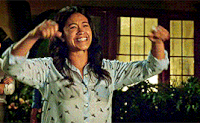
Find the location of `doorway`. doorway is located at coordinates (14, 40).